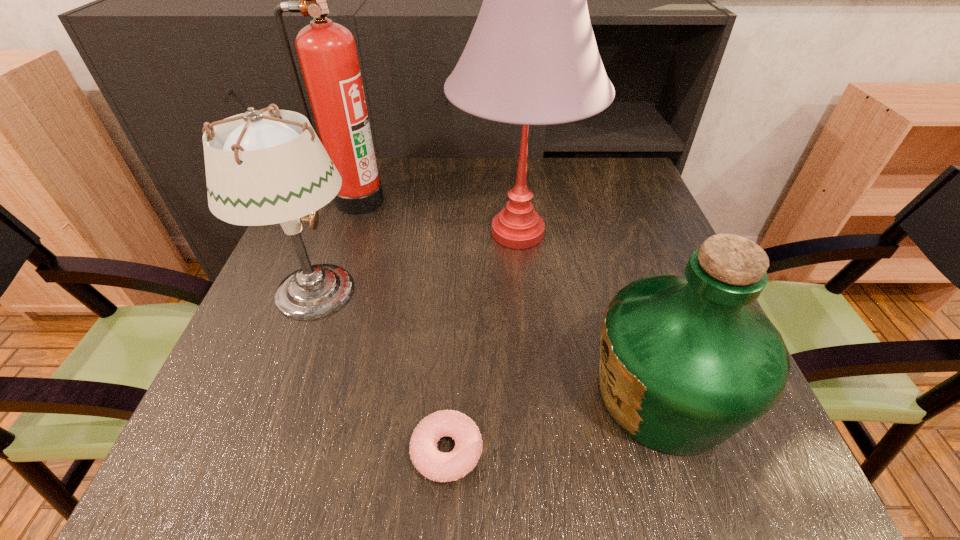
The image size is (960, 540). Find the location of `vacant space located 0.220m on the label side of the second shortest object`. vacant space located 0.220m on the label side of the second shortest object is located at coordinates (454, 395).

Locate an element on the screen. vacant space located on the label side of the second shortest object is located at coordinates (406, 395).

The width and height of the screenshot is (960, 540). I want to click on vacant area situated on the label side of the second shortest object, so click(x=371, y=395).

At what (x,y) coordinates should I click in order to perform the action: click on blank space located 0.080m on the back of the shortest object. Please return your answer as a coordinate pair (x, y). This screenshot has height=540, width=960. Looking at the image, I should click on (451, 375).

At what (x,y) coordinates should I click in order to perform the action: click on table lamp that is at the far edge. Please return your answer as a coordinate pair (x, y). This screenshot has width=960, height=540. Looking at the image, I should click on (532, 59).

I want to click on fire extinguisher that is positioned at the far edge, so click(x=327, y=53).

Where is `liquor located at the near edge`? The width and height of the screenshot is (960, 540). liquor located at the near edge is located at coordinates (686, 362).

Identify the location of doughnut that is at the near edge. (441, 467).

I want to click on fire extinguisher located in the left edge section of the desktop, so click(x=327, y=53).

You are a GUI agent. You are given a task and a screenshot of the screen. Output one action in this format:
    pyautogui.click(x=<x>, y=<y>)
    Task: Click on the lampshade located in the left edge section of the desktop
    The height and width of the screenshot is (540, 960).
    Given the screenshot: What is the action you would take?
    pyautogui.click(x=260, y=170)